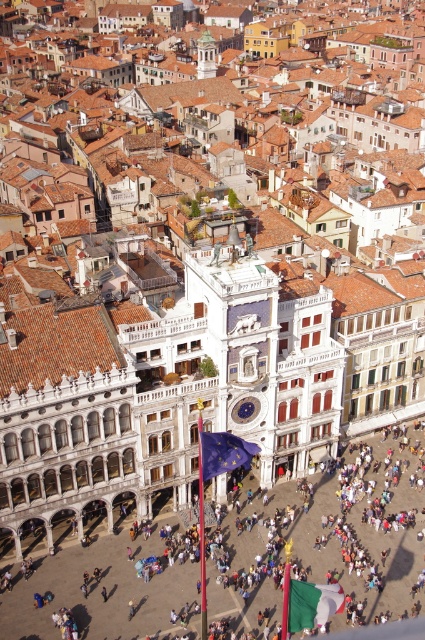
Is point (277, 515) farther from camera compared to point (169, 326)?

Yes, point (277, 515) is farther from viewer.

Which is in front, point (149, 611) or point (337, 438)?

Positioned in front is point (149, 611).

You are a GUI agent. You are given a task and a screenshot of the screen. Output one action in this format:
    pyautogui.click(x=<x>, y=<y>)
    Task: Click on the white stone flagpole at center
    The height and width of the screenshot is (640, 425).
    Given the screenshot: What is the action you would take?
    pyautogui.click(x=325, y=541)

Is white stone flagpole at center bigger than gold textured dome at center?

Yes, white stone flagpole at center is bigger than gold textured dome at center.

Based on the photo, who is positioned more to the left, white stone flagpole at center or gold textured dome at center?

gold textured dome at center is more to the left.

Does point (339, 476) lie behind point (209, 38)?

No.

The width and height of the screenshot is (425, 640). I want to click on white stone flagpole at center, so pos(325,541).

Is point (235, 349) positioned behind point (203, 72)?

No, (235, 349) is in front of (203, 72).

Does white marble clock tower at center have a greater width compared to gold textured dome at center?

Indeed, white marble clock tower at center has a greater width compared to gold textured dome at center.

Who is more forward, (302, 374) or (210, 38)?

Point (302, 374) is more forward.

This screenshot has width=425, height=640. I want to click on white marble clock tower at center, so click(238, 365).